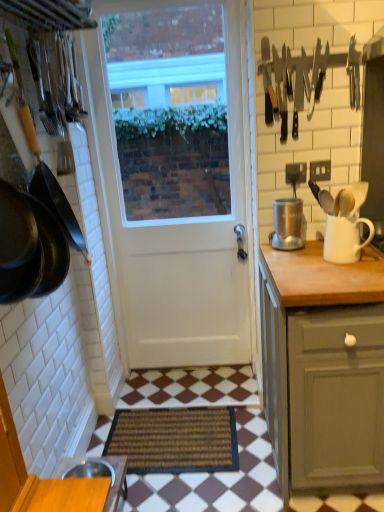
Find the location of `vacant space that is in between brown woven mat at center and matte gray cabinet at right`. vacant space that is in between brown woven mat at center and matte gray cabinet at right is located at coordinates (234, 482).